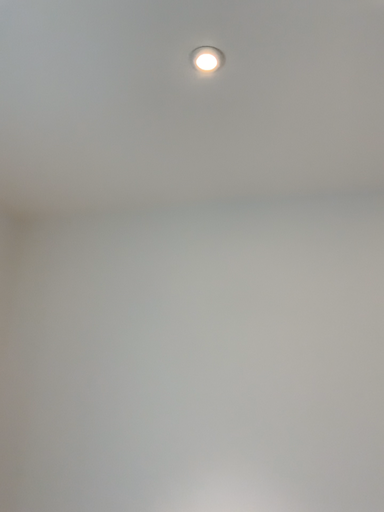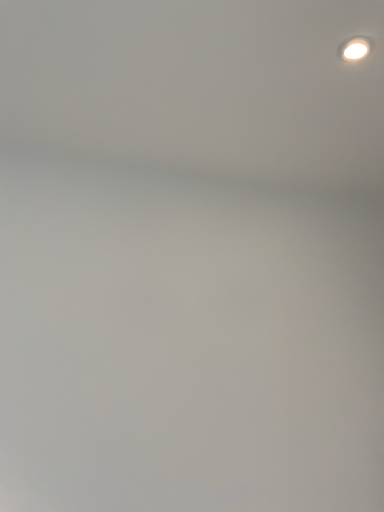
Question: Which way did the camera rotate in the video?

Choices:
 (A) rotated left
 (B) rotated right

Answer: (B)